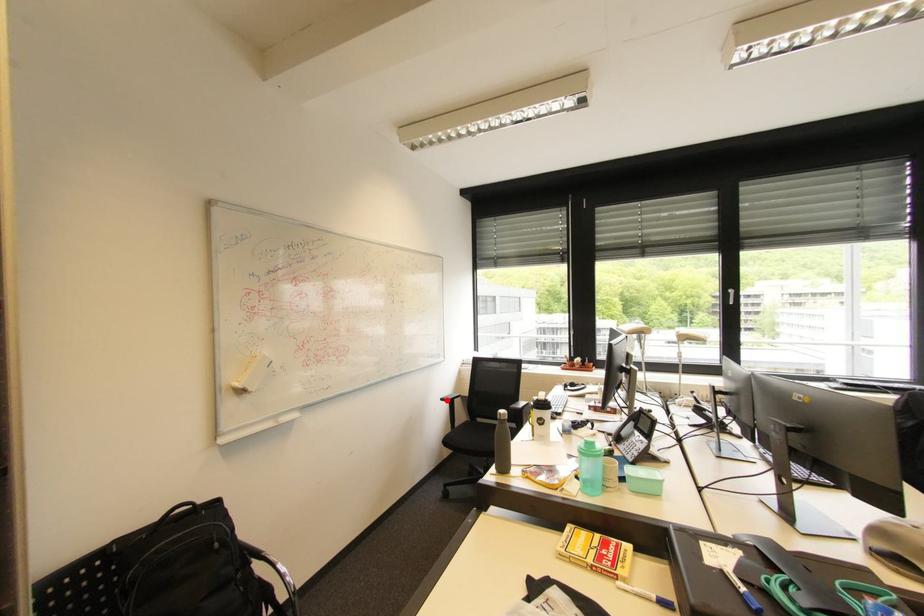
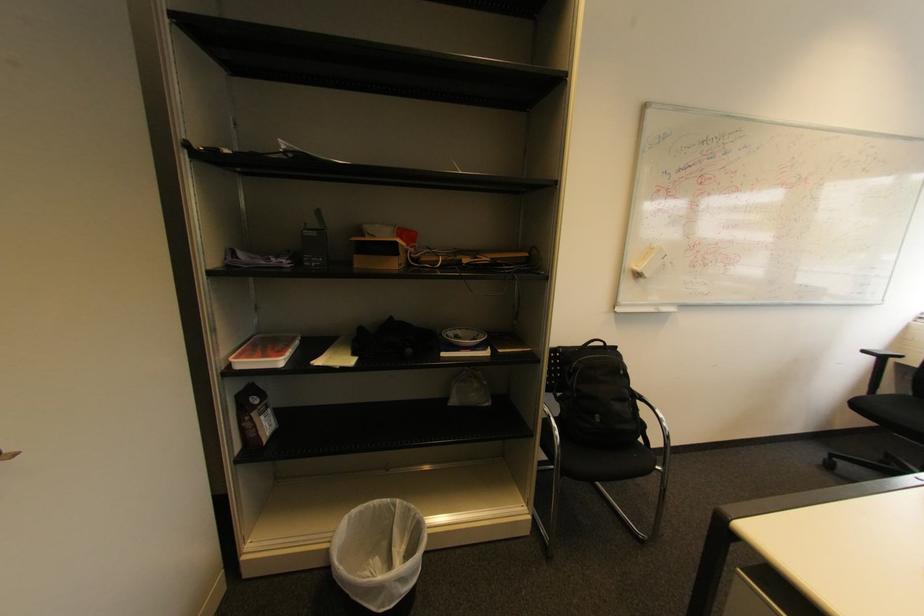
Question: I am providing you with two images of the same scene from different viewpoints. In image1, a red point is highlighted. Considering the same 3D point in image2, which of the following is correct?

Choices:
 (A) It is closer
 (B) It is farther

Answer: (B)